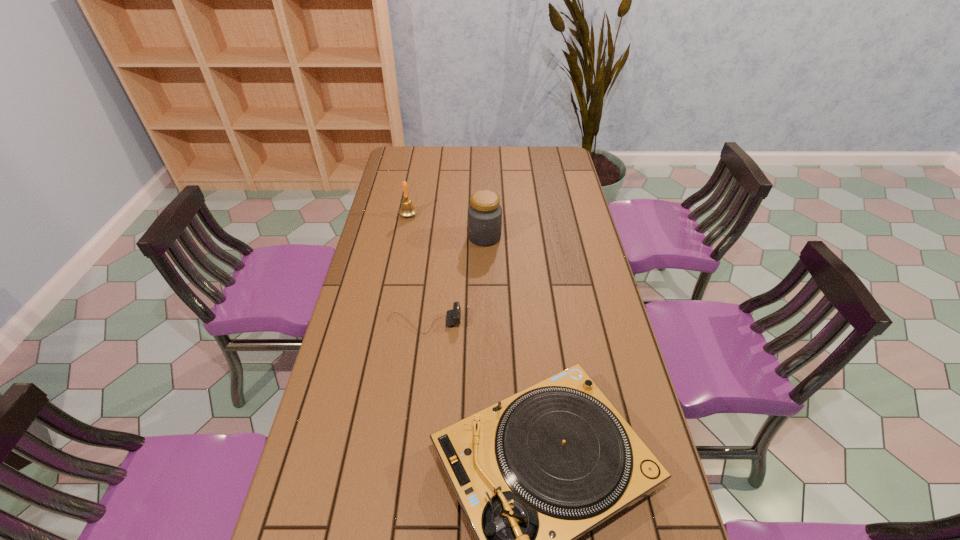
Where is `object that is the third nearest to the webcam`? The width and height of the screenshot is (960, 540). object that is the third nearest to the webcam is located at coordinates (407, 209).

Point out which object is positioned as the nearest to the second farthest object. Please provide its 2D coordinates. Your answer should be formatted as a tuple, i.e. [(x, y)], where the tuple contains the x and y coordinates of a point satisfying the conditions above.

[(407, 209)]